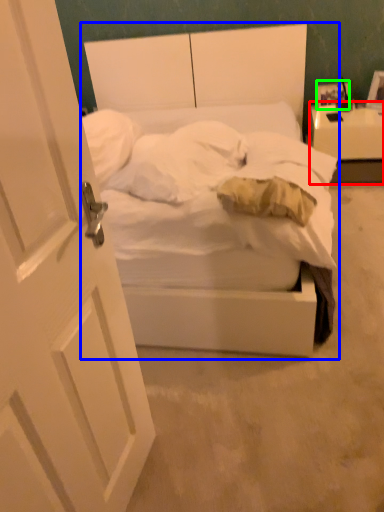
Question: Which object is positioned farthest from nightstand (highlighted by a red box)? Select from bed (highlighted by a blue box) and picture frame (highlighted by a green box).

Choices:
 (A) bed
 (B) picture frame

Answer: (A)